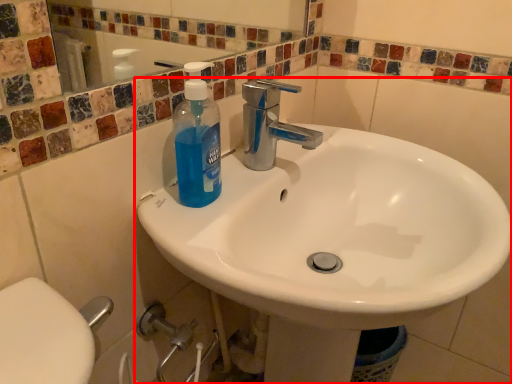
Question: From the image's perspective, what is the correct spatial relationship of sink (annotated by the red box) in relation to cleaning product?

Choices:
 (A) below
 (B) above

Answer: (A)